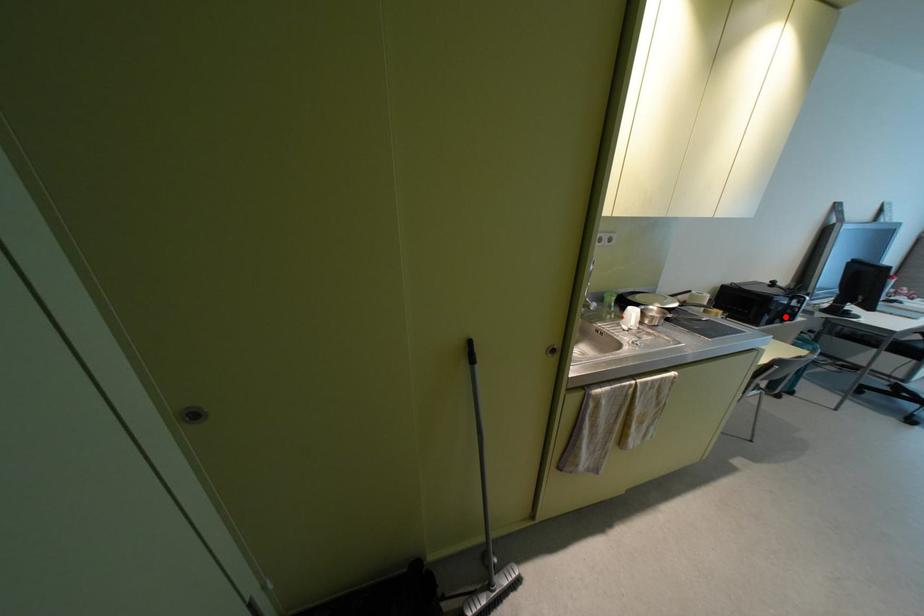
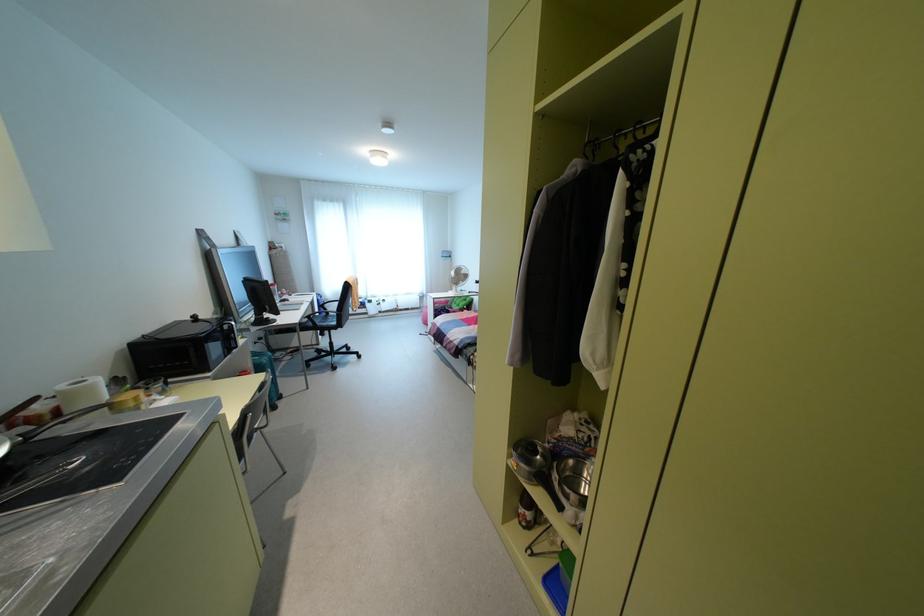
In the second image, find the point that corresponds to the highlighted location in the first image.

(229, 346)